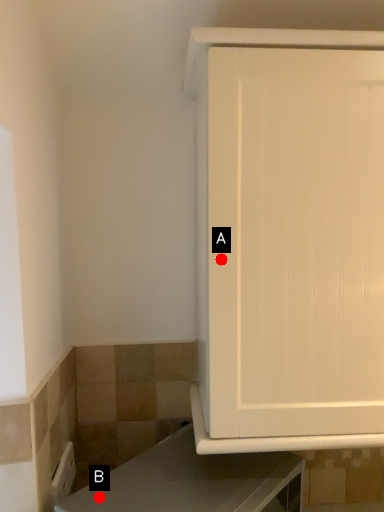
Question: Two points are circled on the image, labeled by A and B beside each circle. Among these points, which one is nearest to the camera?

Choices:
 (A) A is closer
 (B) B is closer

Answer: (B)